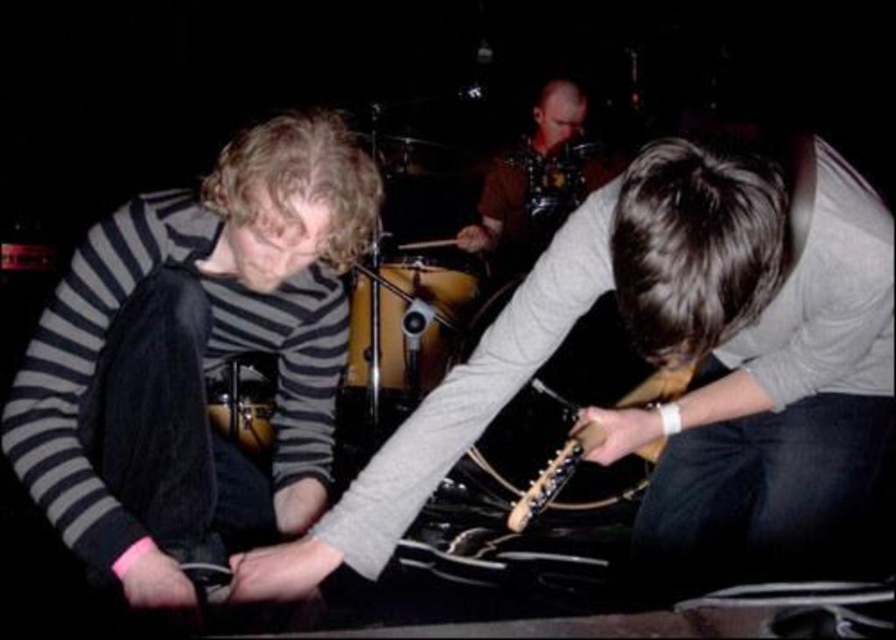
You are a stagehand setting up equipment for the performance. The wooden electric guitar at center needs to be moved to the left side of the keyboard player in the striped shirt. Given its current position at point 0.564 on the x and 0.758 on the y coordinates, can you determine if moving it left will place it within the performer area?

The wooden electric guitar at center is currently located at coordinates (678, 360). Moving it to the left would decrease the x coordinate. Since the keyboard player in the striped shirt is at a lower x coordinate than the guitar, moving it left would place it within the performer area.

Consider the image. You are a stagehand setting up equipment for a live music performance. You need to place a microphone stand between the wooden electric guitar at center and the wooden electric guitar at lower center. Given that the microphone stand requires 30 centimeters of space to fit, will there be enough room between the two guitars?

The wooden electric guitar at center and wooden electric guitar at lower center are 34.57 centimeters apart from each other. Since the microphone stand needs 30 centimeters of space, there is sufficient room to place it between them.